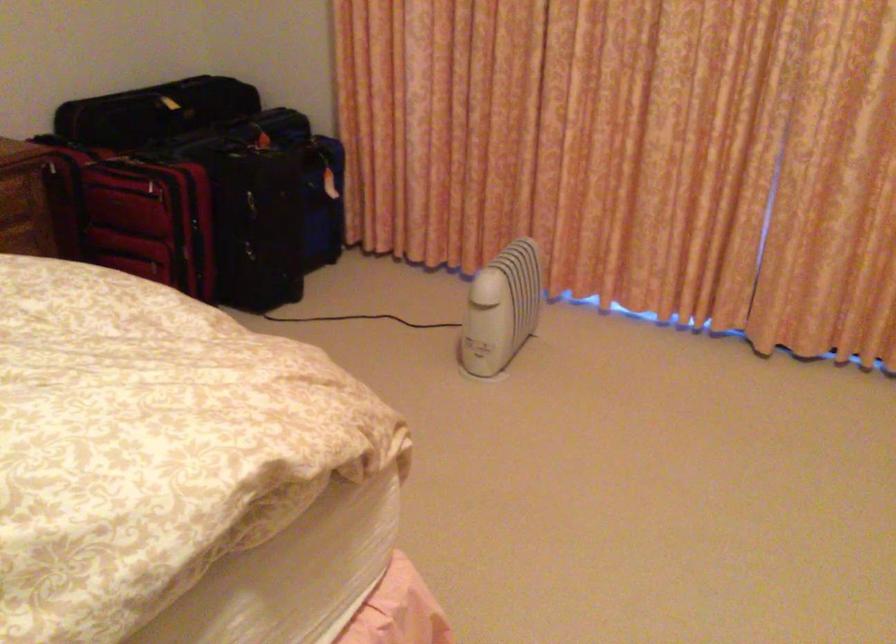
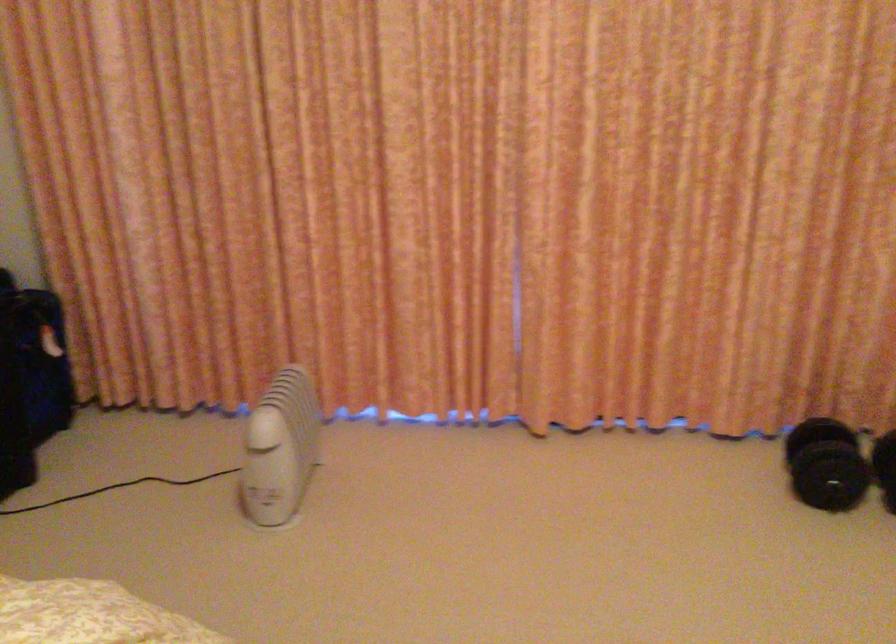
The images are taken continuously from a first-person perspective. In which direction are you moving?

The cameraman moved toward left, forward.